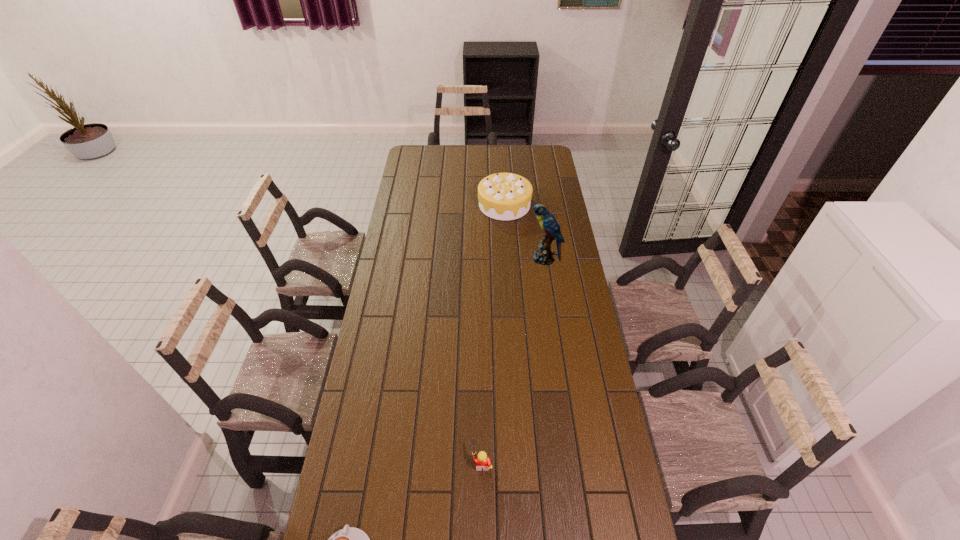
Find the location of a particular element. Image resolution: width=960 pixels, height=540 pixels. parrot is located at coordinates [x=543, y=255].

Find the location of a particular element. This screenshot has height=540, width=960. the tallest object is located at coordinates (x=543, y=255).

The height and width of the screenshot is (540, 960). In order to click on birthday cake in this screenshot , I will do `click(502, 196)`.

Locate an element on the screen. This screenshot has width=960, height=540. the farthest object is located at coordinates (502, 196).

Where is `the third farthest object`? the third farthest object is located at coordinates (482, 461).

You are a GUI agent. You are given a task and a screenshot of the screen. Output one action in this format:
    pyautogui.click(x=<x>, y=<y>)
    Task: Click on the free space located on the face of the parrot
    The width and height of the screenshot is (960, 540).
    Given the screenshot: What is the action you would take?
    pyautogui.click(x=468, y=259)

This screenshot has height=540, width=960. Find the location of `vacant space situated on the face of the parrot`. vacant space situated on the face of the parrot is located at coordinates (461, 259).

I want to click on vacant space situated on the face of the parrot, so click(x=505, y=259).

The image size is (960, 540). Identify the location of free location located 0.280m on the back of the farthest object. (502, 161).

This screenshot has width=960, height=540. What are the coordinates of `vacant space situated 0.400m in front of the third farthest object with the accessory visible` in the screenshot? It's located at (343, 462).